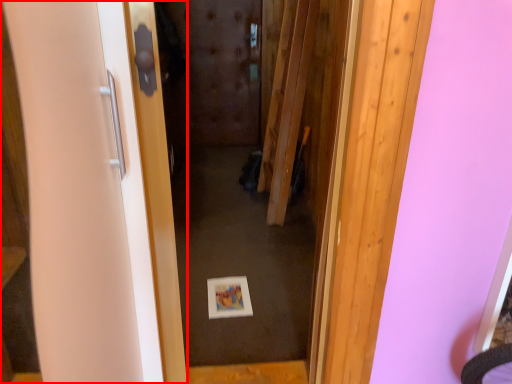
Question: Where is door (annotated by the red box) located in relation to door in the image?

Choices:
 (A) right
 (B) left

Answer: (B)